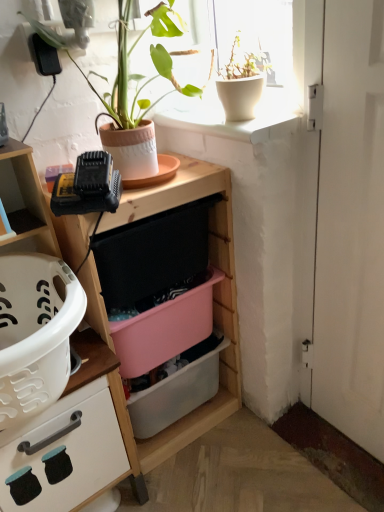
Question: Considering the relative sizes of matte wood cabinet at left and white matte door at right in the image provided, is matte wood cabinet at left bigger than white matte door at right?

Choices:
 (A) yes
 (B) no

Answer: (A)

Question: Is matte wood cabinet at left oriented towards white matte door at right?

Choices:
 (A) no
 (B) yes

Answer: (A)

Question: Considering the relative sizes of matte wood cabinet at left and white matte door at right in the image provided, is matte wood cabinet at left smaller than white matte door at right?

Choices:
 (A) no
 (B) yes

Answer: (A)

Question: Can we say matte wood cabinet at left lies outside white matte door at right?

Choices:
 (A) yes
 (B) no

Answer: (A)

Question: Does matte wood cabinet at left appear on the left side of white matte door at right?

Choices:
 (A) no
 (B) yes

Answer: (B)

Question: Is pink plastic storage box at center, which ranks as the 1th storage box in bottom-to-top order, inside the boundaries of terracotta clay pot at upper center, arranged as the 2th houseplant when viewed from the right, or outside?

Choices:
 (A) outside
 (B) inside

Answer: (A)

Question: Is pink plastic storage box at center, placed as the second storage box when sorted from top to bottom, to the left or to the right of terracotta clay pot at upper center, arranged as the 2th houseplant when viewed from the right, in the image?

Choices:
 (A) left
 (B) right

Answer: (B)

Question: From their relative heights in the image, would you say pink plastic storage box at center, placed as the second storage box when sorted from top to bottom, is taller or shorter than terracotta clay pot at upper center, the first houseplant in the left-to-right sequence?

Choices:
 (A) short
 (B) tall

Answer: (A)

Question: From the image's perspective, relative to terracotta clay pot at upper center, the first houseplant in the left-to-right sequence, is pink plastic storage box at center, which ranks as the 1th storage box in bottom-to-top order, above or below?

Choices:
 (A) above
 (B) below

Answer: (B)

Question: From the image's perspective, is pink plastic storage box at center, placed as the second storage box when sorted from top to bottom, positioned above or below pink plastic storage box at center, placed as the 2th storage box when sorted from bottom to top?

Choices:
 (A) above
 (B) below

Answer: (B)

Question: Considering their positions, is pink plastic storage box at center, which ranks as the 1th storage box in bottom-to-top order, located in front of or behind pink plastic storage box at center, marked as the 1th storage box in a top-to-bottom arrangement?

Choices:
 (A) behind
 (B) front

Answer: (A)

Question: In terms of height, does pink plastic storage box at center, which ranks as the 1th storage box in bottom-to-top order, look taller or shorter compared to pink plastic storage box at center, placed as the 2th storage box when sorted from bottom to top?

Choices:
 (A) tall
 (B) short

Answer: (A)

Question: From a real-world perspective, relative to pink plastic storage box at center, placed as the 2th storage box when sorted from bottom to top, is pink plastic storage box at center, placed as the second storage box when sorted from top to bottom, vertically above or below?

Choices:
 (A) above
 (B) below

Answer: (B)

Question: Looking at their shapes, would you say wooden shelf at center is wider or thinner than pink plastic storage box at center, which ranks as the 1th storage box in bottom-to-top order?

Choices:
 (A) thin
 (B) wide

Answer: (B)

Question: From a real-world perspective, is wooden shelf at center positioned above or below pink plastic storage box at center, which ranks as the 1th storage box in bottom-to-top order?

Choices:
 (A) below
 (B) above

Answer: (B)